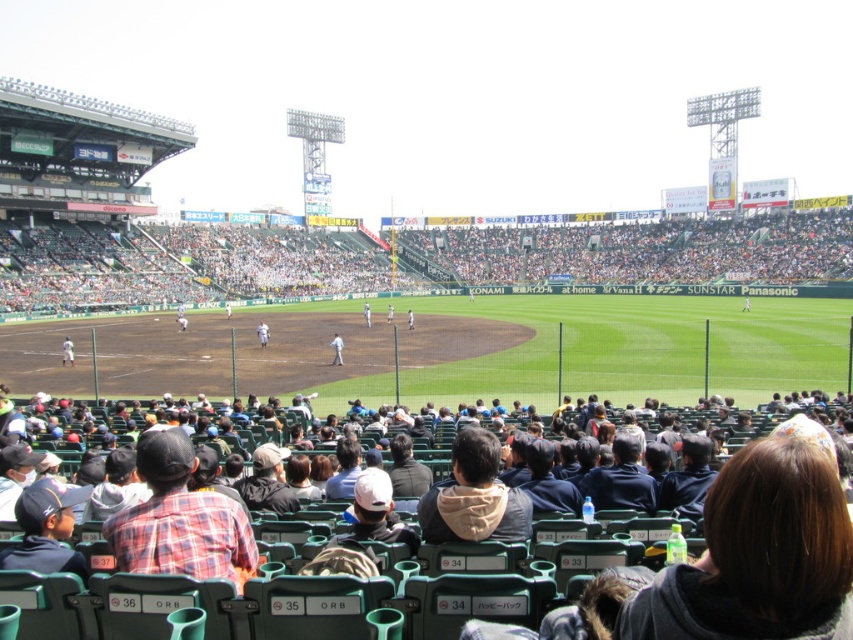
Question: Is dark blue hoodie at center to the left of dark gray jacket at center from the viewer's perspective?

Choices:
 (A) no
 (B) yes

Answer: (A)

Question: Which is farther from the dark blue jersey at lower left?

Choices:
 (A) dark blue jacket at center
 (B) white fabric uniform at center

Answer: (B)

Question: Among these points, which one is farthest from the camera?

Choices:
 (A) (634, 445)
 (B) (524, 500)
 (C) (78, 490)
 (D) (138, 456)

Answer: (A)

Question: Which of the following is the farthest from the observer?

Choices:
 (A) (338, 348)
 (B) (402, 442)

Answer: (A)

Question: Is dark blue hoodie at center smaller than dark gray jacket at center?

Choices:
 (A) yes
 (B) no

Answer: (A)

Question: Can you confirm if dark blue jersey at lower left is thinner than khaki fabric cap at center?

Choices:
 (A) yes
 (B) no

Answer: (A)